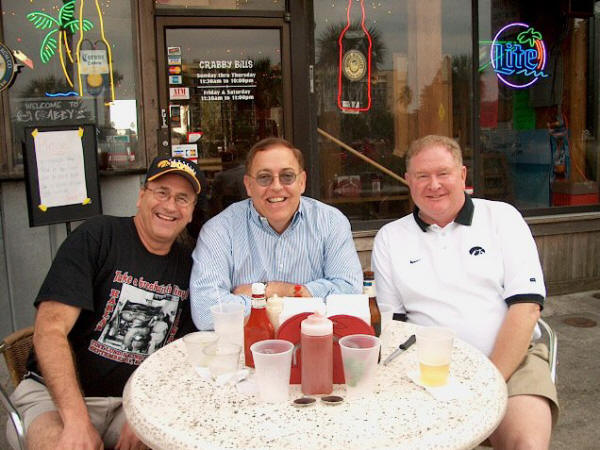
This screenshot has height=450, width=600. In order to click on beer sign in this screenshot , I will do click(98, 54), click(349, 54), click(518, 59).